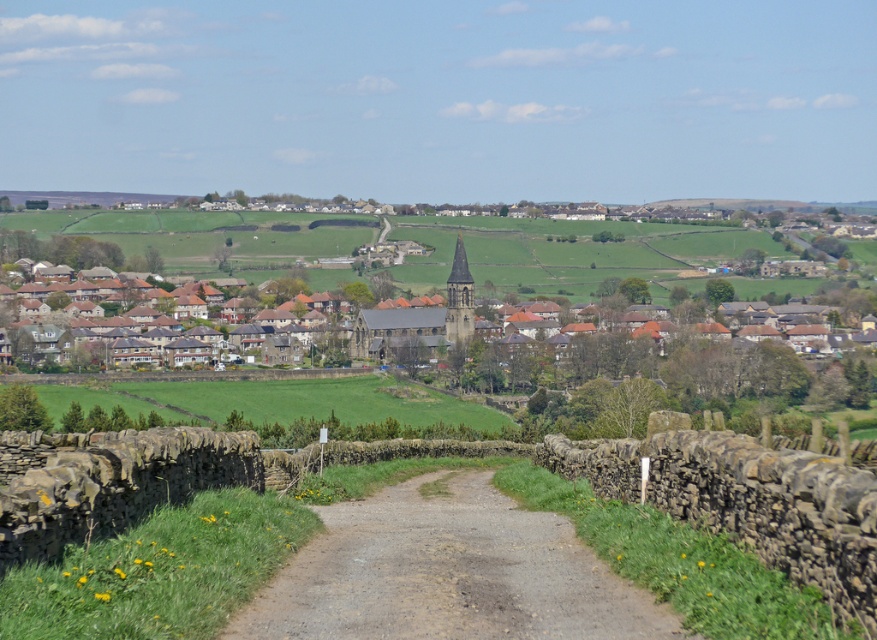
Does point (272, 588) lie behind point (450, 307)?

No, (272, 588) is in front of (450, 307).

The height and width of the screenshot is (640, 877). Describe the element at coordinates (447, 573) in the screenshot. I see `dirt road at center` at that location.

Is point (460, 550) farther from camera compared to point (714, 330)?

No, it is not.

Image resolution: width=877 pixels, height=640 pixels. In order to click on dirt road at center in this screenshot , I will do `click(447, 573)`.